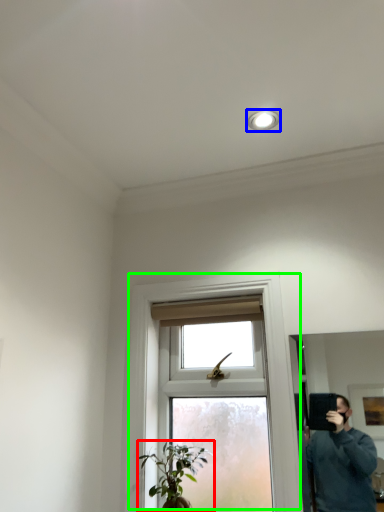
Question: Based on their relative distances, which object is nearer to houseplant (highlighted by a red box)? Choose from light fixture (highlighted by a blue box) and window (highlighted by a green box).

Choices:
 (A) light fixture
 (B) window

Answer: (B)